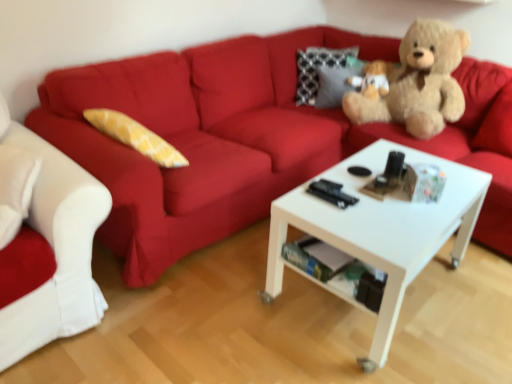
Where is `vacant space to the left of white matte coffee table at center`? Image resolution: width=512 pixels, height=384 pixels. vacant space to the left of white matte coffee table at center is located at coordinates (217, 309).